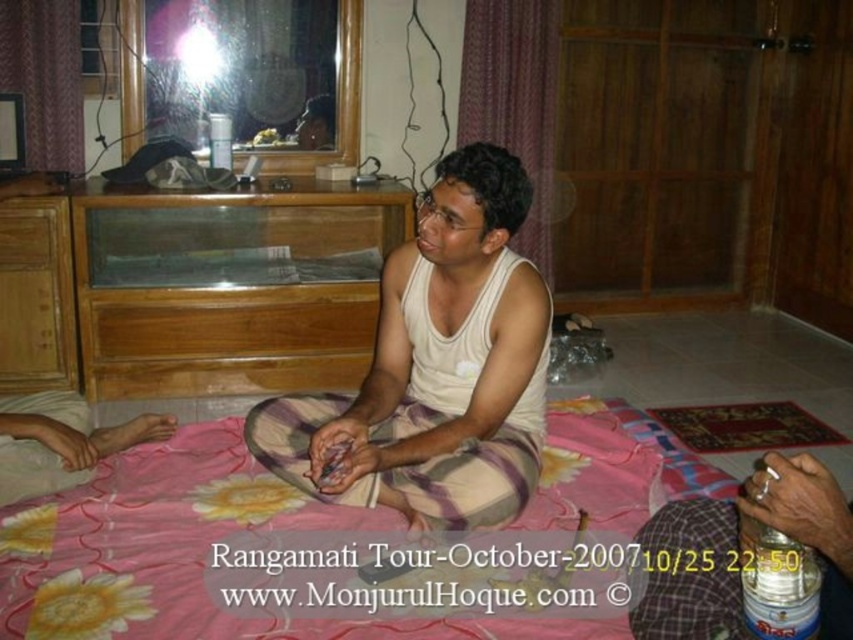
You are a fashion designer observing the image. You need to determine which item is shorter between the pink floral blanket at center and the white cotton tank top at center. Which one is shorter?

The pink floral blanket at center is not as tall as the white cotton tank top at center, so the pink floral blanket at center is shorter.

You are a delivery robot that is 0.5 meters wide and 1.2 meters tall. You need to deliver a package to the man sitting on the bed. The path to the bed requires passing through the space between the pink floral blanket at center and the viewer. Can you fit through this space?

Answer: The distance between the pink floral blanket at center and the viewer is 1.42 meters. Since the robot is 0.5 meters wide and 1.2 meters tall, it can fit through the space as the width and height are sufficient.